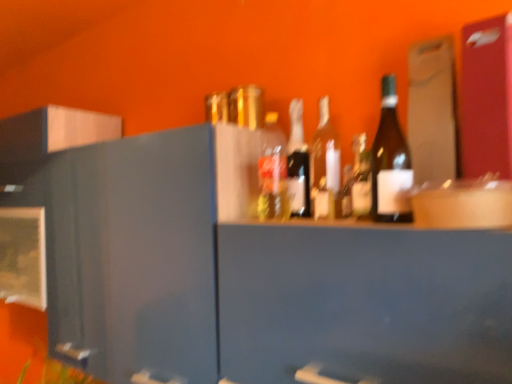
Question: In the image, is translucent glass bottle at center, the 2th bottle in the back-to-front sequence, on the left side or the right side of translucent glass bottle at center, the 6th bottle when ordered from front to back?

Choices:
 (A) left
 (B) right

Answer: (A)

Question: Is point (266, 175) closer or farther from the camera than point (291, 117)?

Choices:
 (A) closer
 (B) farther

Answer: (A)

Question: Which is nearer to the translucent glass bottle at center, the 6th bottle when ordered from front to back?

Choices:
 (A) matte glass bottle at center, which is counted as the third bottle, starting from the front
 (B) matte glass bottle at center, positioned as the fifth bottle in back-to-front order
 (C) translucent glass bottle at center, the 2th bottle in the back-to-front sequence
 (D) translucent glass bottle at center, placed as the 3th bottle when sorted from back to front
 (E) green glass bottle at upper right, positioned as the sixth bottle in back-to-front order

Answer: (C)

Question: Based on their relative distances, which object is farther from the green glass bottle at upper right, positioned as the sixth bottle in back-to-front order?

Choices:
 (A) translucent glass bottle at center, arranged as the 1th bottle when viewed from the back
 (B) matte glass bottle at center, which is the fourth bottle from back to front
 (C) translucent glass bottle at center, the 2th bottle in the back-to-front sequence
 (D) translucent glass bottle at center, placed as the 3th bottle when sorted from back to front
 (E) matte glass bottle at center, positioned as the fifth bottle in back-to-front order

Answer: (C)